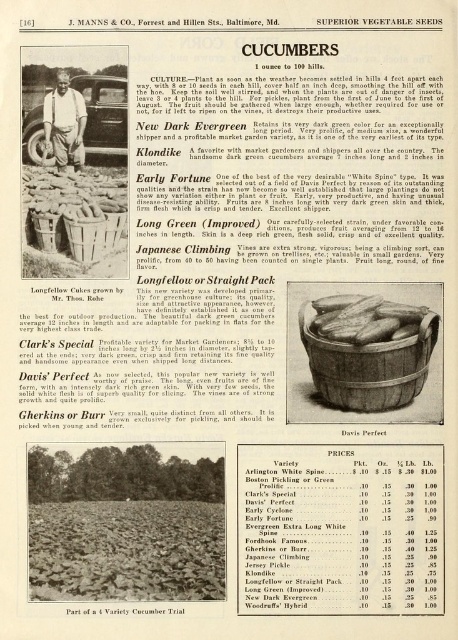
Question: Which is farther from the wooden at center?

Choices:
 (A) wooden barrel at center
 (B) matte brown wicker basket at center
 (C) green matte cucumber at center
 (D) light brown wooden chair at center

Answer: (A)

Question: Which point is closer to the camera?

Choices:
 (A) (61, 180)
 (B) (375, 381)
 (C) (70, 214)
 (D) (392, 307)

Answer: (A)

Question: Which of these objects is positioned closest to the light brown wooden chair at center?

Choices:
 (A) matte brown wicker basket at center
 (B) wooden barrel at center
 (C) green matte cucumber at center

Answer: (C)

Question: Is the position of smooth brown basket at center less distant than that of light brown wooden chair at center?

Choices:
 (A) yes
 (B) no

Answer: (B)

Question: Is light brown wooden chair at center above matte brown wicker basket at center?

Choices:
 (A) no
 (B) yes

Answer: (B)

Question: Is wooden barrel at center to the right of green matte cucumber at center from the viewer's perspective?

Choices:
 (A) no
 (B) yes

Answer: (B)